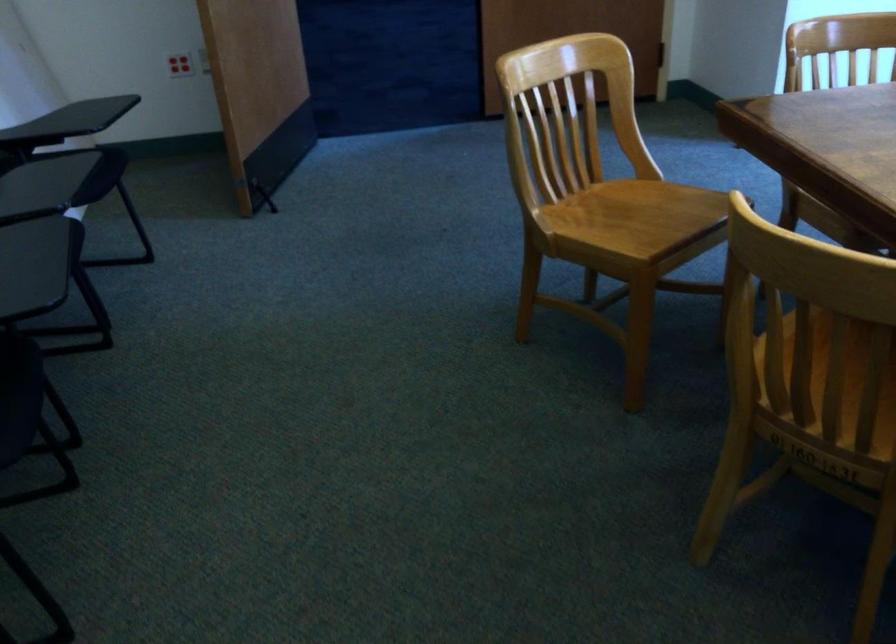
Find where to sit the black chair sitting surface. Please return your answer as a coordinate pair (x, y).

(82, 174)